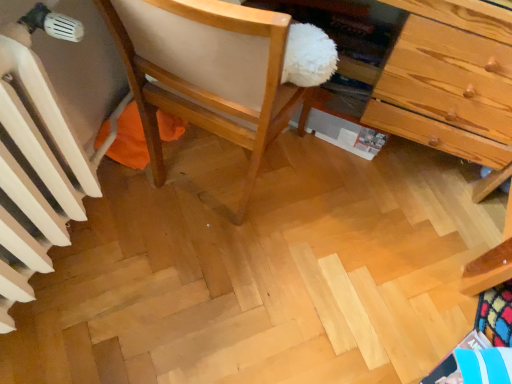
Question: Is the depth of wooden chair at center less than that of white painted radiator at left?

Choices:
 (A) yes
 (B) no

Answer: (B)

Question: Does wooden chair at center have a larger size compared to white painted radiator at left?

Choices:
 (A) no
 (B) yes

Answer: (B)

Question: Is wooden chair at center positioned with its back to white painted radiator at left?

Choices:
 (A) no
 (B) yes

Answer: (B)

Question: From a real-world perspective, is wooden chair at center located higher than white painted radiator at left?

Choices:
 (A) yes
 (B) no

Answer: (A)

Question: Is wooden chair at center further to the viewer compared to white painted radiator at left?

Choices:
 (A) no
 (B) yes

Answer: (B)

Question: Does wooden chair at center contain white painted radiator at left?

Choices:
 (A) yes
 (B) no

Answer: (B)

Question: Is white painted radiator at left thinner than wooden chair at center?

Choices:
 (A) yes
 (B) no

Answer: (A)

Question: Does white painted radiator at left turn towards wooden chair at center?

Choices:
 (A) no
 (B) yes

Answer: (A)

Question: From a real-world perspective, is white painted radiator at left physically above wooden chair at center?

Choices:
 (A) no
 (B) yes

Answer: (A)

Question: Is white painted radiator at left closer to the viewer compared to wooden chair at center?

Choices:
 (A) no
 (B) yes

Answer: (B)

Question: Is white painted radiator at left to the right of wooden chair at center from the viewer's perspective?

Choices:
 (A) yes
 (B) no

Answer: (B)

Question: Is white painted radiator at left to the left of wooden chair at center from the viewer's perspective?

Choices:
 (A) yes
 (B) no

Answer: (A)

Question: From the image's perspective, relative to white painted radiator at left, is wooden chair at center above or below?

Choices:
 (A) below
 (B) above

Answer: (B)